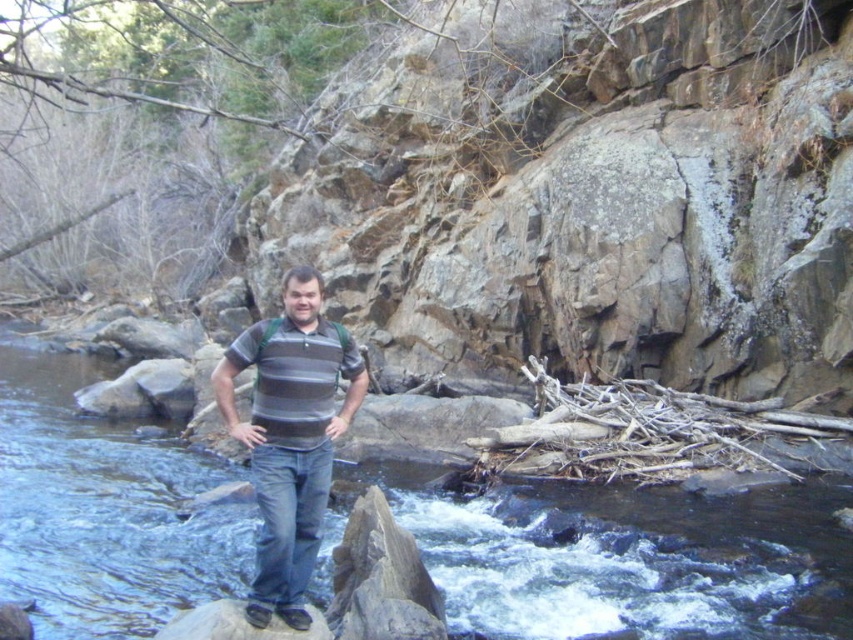
Can you confirm if clear water at center is shorter than striped cotton shirt at center?

Yes.

From the picture: Which of these two, clear water at center or striped cotton shirt at center, stands shorter?

clear water at center is shorter.

Is point (703, 636) closer to camera compared to point (280, 582)?

No, (703, 636) is further to viewer.

In order to click on clear water at center in this screenshot , I will do `click(630, 557)`.